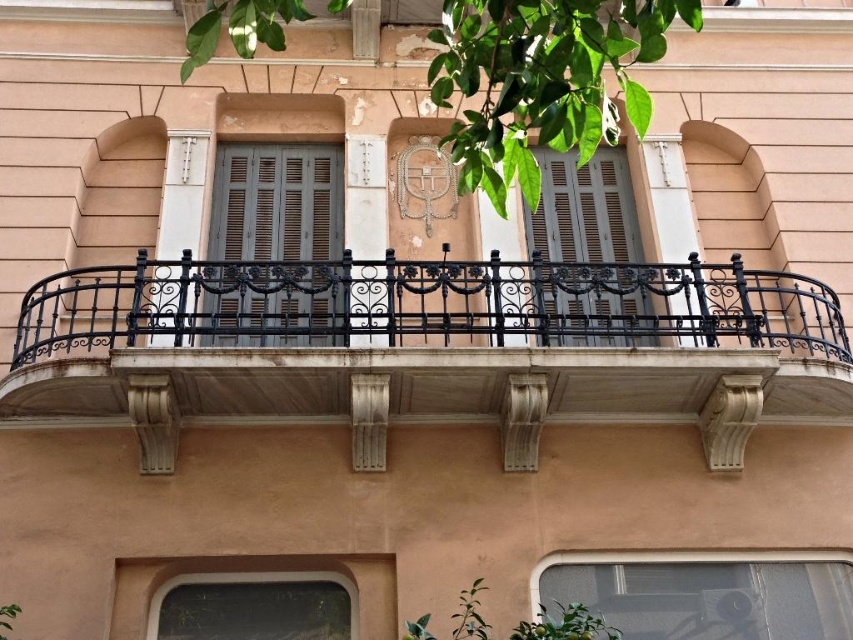
You are a window installer working on a building facade. You need to install a new clear glass window at lower center that is 2 feet wide. There is already a matte gray wood shutter at center. What is the minimum distance you should maintain between the new window and the existing shutter to comply with the building code requirement of at least 18 feet apart?

The existing distance between the matte gray wood shutter at center and the clear glass window at lower center is 17.83 feet. Since the required minimum distance is 18 feet, the installer needs to increase the spacing by at least 0.17 feet to meet the code requirement.

You are an architect assessing the building facade. You need to determine which window, the transparent glass window at lower right or the clear glass window at lower center, has a greater width for potential design adjustments. Based on the scene, which window is wider?

The transparent glass window at lower right is wider than the clear glass window at lower center according to the description.

You are an architect assessing the building facade. You need to determine if the matte gray wood shutter at center can be lowered to cover the clear glass window at lower center. Based on their sizes, is this possible?

The matte gray wood shutter at center is much taller than the clear glass window at lower center, so it can be lowered to cover it completely.